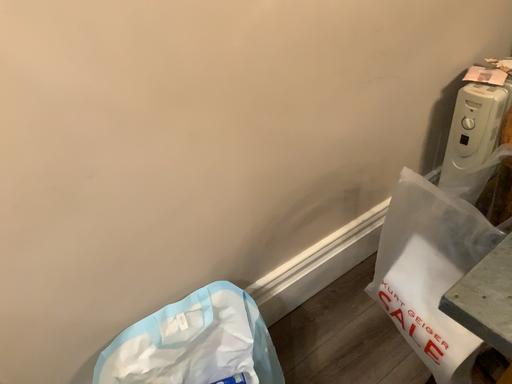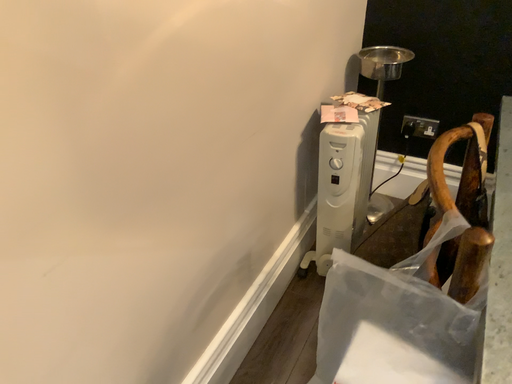
Question: Which way did the camera rotate in the video?

Choices:
 (A) rotated upward
 (B) rotated downward

Answer: (A)